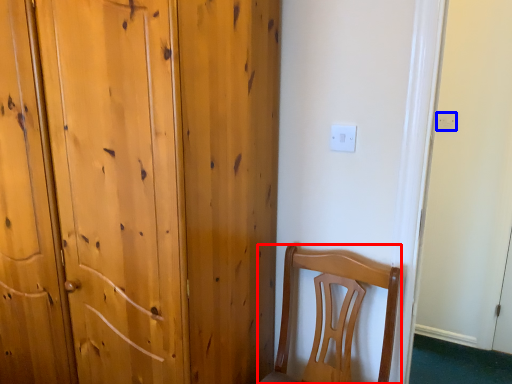
Question: Among these objects, which one is nearest to the camera, chair (highlighted by a red box) or electric outlet (highlighted by a blue box)?

Choices:
 (A) chair
 (B) electric outlet

Answer: (A)